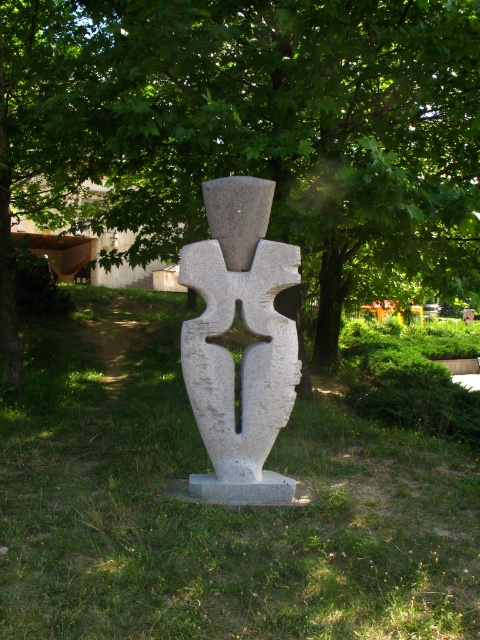
You are standing in front of the sculpture and want to locate two specific points on it. The first point is at coordinates point (324, 67) and the second is at point (241, 406). From your perspective, which point is closer to you?

Point (241, 406) is closer to you because point (324, 67) is behind it.